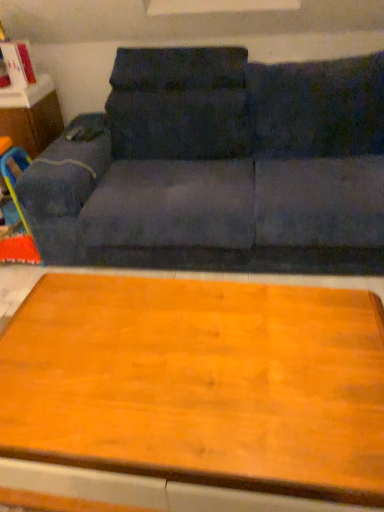
The width and height of the screenshot is (384, 512). I want to click on dark blue fabric couch at upper center, so click(x=218, y=167).

The image size is (384, 512). Describe the element at coordinates (218, 167) in the screenshot. I see `dark blue fabric couch at upper center` at that location.

The height and width of the screenshot is (512, 384). Identify the location of wooden table at lower center. (194, 394).

Describe the element at coordinates (32, 116) in the screenshot. This screenshot has height=512, width=384. I see `matte wood dresser at left` at that location.

At what (x,y) coordinates should I click in order to perform the action: click on dark blue fabric couch at upper center. Please return your answer as a coordinate pair (x, y). Looking at the image, I should click on (218, 167).

Are wooden table at lower center and dark blue fabric couch at upper center making contact?

No, wooden table at lower center is not next to dark blue fabric couch at upper center.

How many degrees apart are the facing directions of wooden table at lower center and dark blue fabric couch at upper center?

They differ by 1.39 degrees in their facing directions.

Is wooden table at lower center oriented towards dark blue fabric couch at upper center?

No, wooden table at lower center is not facing towards dark blue fabric couch at upper center.

Based on their sizes in the image, would you say wooden table at lower center is bigger or smaller than dark blue fabric couch at upper center?

In the image, wooden table at lower center appears to be smaller than dark blue fabric couch at upper center.

In the scene shown: Is dark blue fabric couch at upper center closer to the viewer compared to wooden table at lower center?

No, the depth of dark blue fabric couch at upper center is greater than that of wooden table at lower center.

Is dark blue fabric couch at upper center far away from wooden table at lower center?

No, dark blue fabric couch at upper center is not far away from wooden table at lower center.

You are a GUI agent. You are given a task and a screenshot of the screen. Output one action in this format:
    pyautogui.click(x=<x>, y=<y>)
    Task: Click on the table lying on the left of dark blue fabric couch at upper center
    This screenshot has width=384, height=512.
    Given the screenshot: What is the action you would take?
    pyautogui.click(x=194, y=394)

How much distance is there between dark blue fabric couch at upper center and wooden table at lower center?

dark blue fabric couch at upper center is 35.96 inches away from wooden table at lower center.

Is dark blue fabric couch at upper center facing away from matte wood dresser at left?

No.

Between dark blue fabric couch at upper center and matte wood dresser at left, which one is positioned in front?

dark blue fabric couch at upper center is in front.

Identify the location of dresser located above the dark blue fabric couch at upper center (from a real-world perspective). Image resolution: width=384 pixels, height=512 pixels. (32, 116).

Is dark blue fabric couch at upper center at the left side of matte wood dresser at left?

No.

In the scene shown: How different are the orientations of wooden table at lower center and matte wood dresser at left in degrees?

→ The facing directions of wooden table at lower center and matte wood dresser at left are 2.19 degrees apart.

Is wooden table at lower center inside or outside of matte wood dresser at left?

wooden table at lower center is not enclosed by matte wood dresser at left.

From the image's perspective, would you say wooden table at lower center is positioned over matte wood dresser at left?

No, from the image's perspective, wooden table at lower center is not above matte wood dresser at left.

Is wooden table at lower center not near matte wood dresser at left?

wooden table at lower center is far away from matte wood dresser at left.

Which is closer, (6, 111) or (239, 444)?

Point (6, 111) is positioned farther from the camera compared to point (239, 444).

Is matte wood dresser at left closer to the viewer compared to wooden table at lower center?

No, matte wood dresser at left is further to the viewer.

Are matte wood dresser at left and wooden table at lower center beside each other?

matte wood dresser at left and wooden table at lower center are not in contact.

Is matte wood dresser at left inside the boundaries of wooden table at lower center, or outside?

matte wood dresser at left lies outside wooden table at lower center.

Would you say matte wood dresser at left contains dark blue fabric couch at upper center?

No, dark blue fabric couch at upper center is not surrounded by matte wood dresser at left.

Would you consider matte wood dresser at left to be distant from dark blue fabric couch at upper center?

Actually, matte wood dresser at left and dark blue fabric couch at upper center are a little close together.

Considering the relative sizes of matte wood dresser at left and dark blue fabric couch at upper center in the image provided, is matte wood dresser at left taller than dark blue fabric couch at upper center?

No, matte wood dresser at left is not taller than dark blue fabric couch at upper center.

Looking at this image, between matte wood dresser at left and dark blue fabric couch at upper center, which one has larger width?

dark blue fabric couch at upper center is wider.

This screenshot has height=512, width=384. Identify the location of table below the dark blue fabric couch at upper center (from a real-world perspective). (194, 394).

In the image, there is a wooden table at lower center. Identify the location of studio couch above it (from the image's perspective). (218, 167).

When comparing their distances from matte wood dresser at left, does dark blue fabric couch at upper center or wooden table at lower center seem further?

The object further to matte wood dresser at left is wooden table at lower center.

When comparing their distances from wooden table at lower center, does dark blue fabric couch at upper center or matte wood dresser at left seem further?

Among the two, matte wood dresser at left is located further to wooden table at lower center.

Looking at the image, which one is located further to dark blue fabric couch at upper center, wooden table at lower center or matte wood dresser at left?

wooden table at lower center.

Estimate the real-world distances between objects in this image. Which object is further from matte wood dresser at left, wooden table at lower center or dark blue fabric couch at upper center?

The object further to matte wood dresser at left is wooden table at lower center.

When comparing their distances from wooden table at lower center, does matte wood dresser at left or dark blue fabric couch at upper center seem closer?

Among the two, dark blue fabric couch at upper center is located nearer to wooden table at lower center.

Looking at the image, which one is located closer to dark blue fabric couch at upper center, matte wood dresser at left or wooden table at lower center?

Among the two, matte wood dresser at left is located nearer to dark blue fabric couch at upper center.

Identify the location of studio couch between wooden table at lower center and matte wood dresser at left from front to back. This screenshot has width=384, height=512. (218, 167).